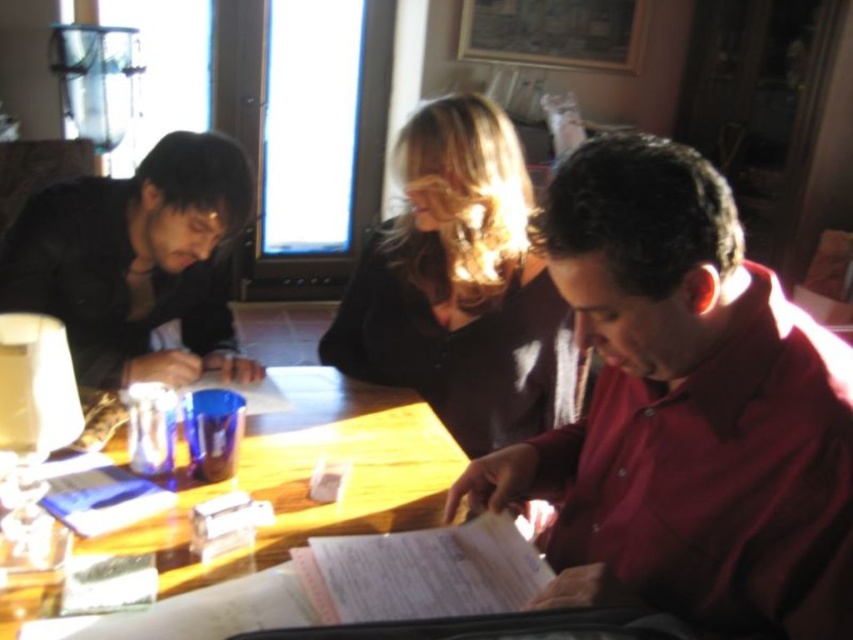
You are a GUI agent. You are given a task and a screenshot of the screen. Output one action in this format:
    pyautogui.click(x=<x>, y=<y>)
    Task: Click on the matte black sweater at center
    The height and width of the screenshot is (640, 853).
    Given the screenshot: What is the action you would take?
    pyautogui.click(x=460, y=285)

Does matte red shirt at center have a larger size compared to matte black shirt at left?

Incorrect, matte red shirt at center is not larger than matte black shirt at left.

Does point (776, 321) come closer to viewer compared to point (141, 308)?

Yes, point (776, 321) is closer to viewer.

From the picture: Who is more distant from viewer, (604,490) or (190,141)?

The point (190,141) is behind.

Locate an element on the screen. The height and width of the screenshot is (640, 853). matte red shirt at center is located at coordinates (685, 410).

Does point (570, 429) come closer to viewer compared to point (395, 292)?

Yes, point (570, 429) is closer to viewer.

Does point (602, 320) come behind point (370, 273)?

No.

Between point (683, 337) and point (505, 278), which one is positioned behind?

Point (505, 278)

What are the coordinates of `matte red shirt at center` in the screenshot? It's located at (685, 410).